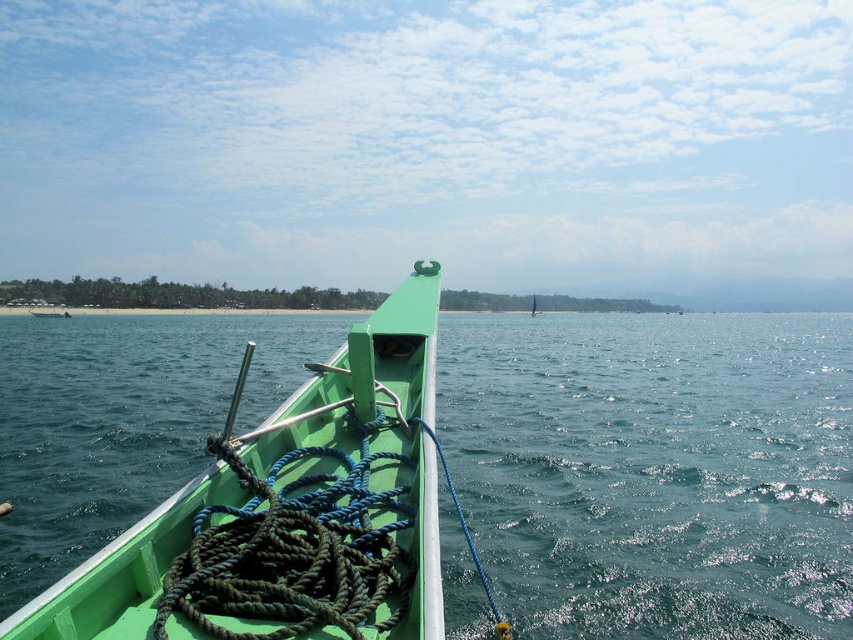
Can you confirm if green matte boat at center is thinner than dark green rope at center?

Yes, green matte boat at center is thinner than dark green rope at center.

Is green matte boat at center above dark green rope at center?

Actually, green matte boat at center is below dark green rope at center.

Is point (71, 602) positioned after point (223, 564)?

No.

In order to click on green matte boat at center in this screenshot , I will do `click(289, 512)`.

Can you confirm if green matte boat at center is bigger than blue braided rope at center?

No.

Does green matte boat at center appear on the right side of blue braided rope at center?

Result: Incorrect, green matte boat at center is not on the right side of blue braided rope at center.

Which is in front, point (206, 605) or point (466, 525)?

Point (206, 605) is more forward.

I want to click on green matte boat at center, so click(x=289, y=512).

Is dark green rope at center closer to camera compared to blue braided rope at center?

Yes, dark green rope at center is closer to the viewer.

From the picture: Between dark green rope at center and blue braided rope at center, which one has more height?

blue braided rope at center is taller.

At what (x,y) coordinates should I click in order to perform the action: click on dark green rope at center. Please return your answer as a coordinate pair (x, y). This screenshot has width=853, height=640. Looking at the image, I should click on (294, 552).